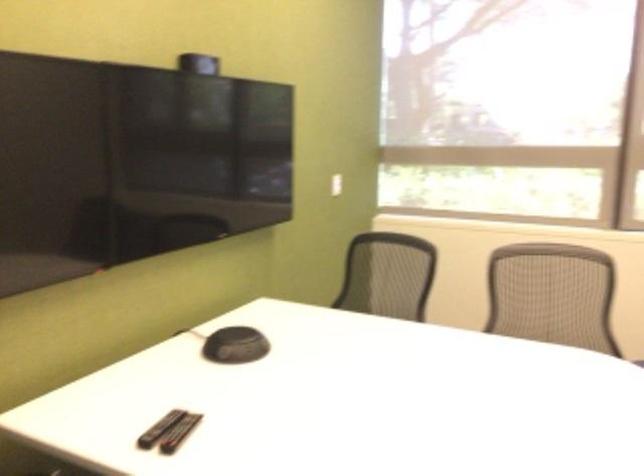
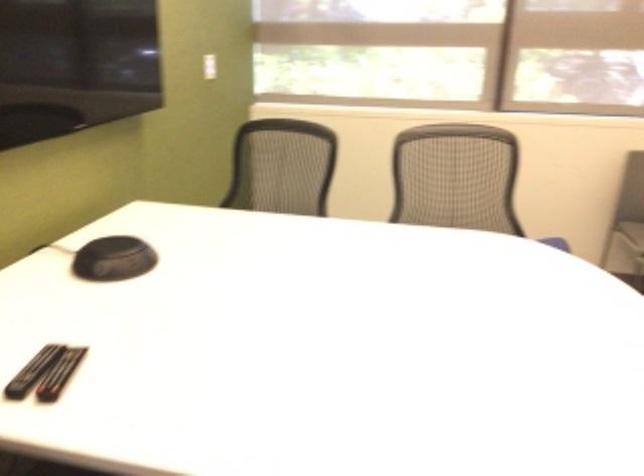
Question: Based on the continuous images, in which direction is the camera rotating? Reply with the corresponding letter.

Choices:
 (A) Left
 (B) Right
 (C) Up
 (D) Down

Answer: (B)